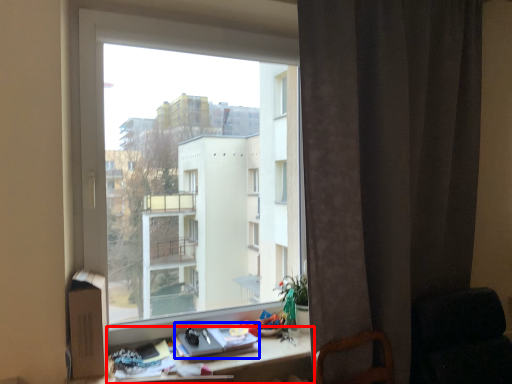
Question: Which object is further to the camera taking this photo, desk (highlighted by a red box) or book (highlighted by a blue box)?

Choices:
 (A) desk
 (B) book

Answer: (B)